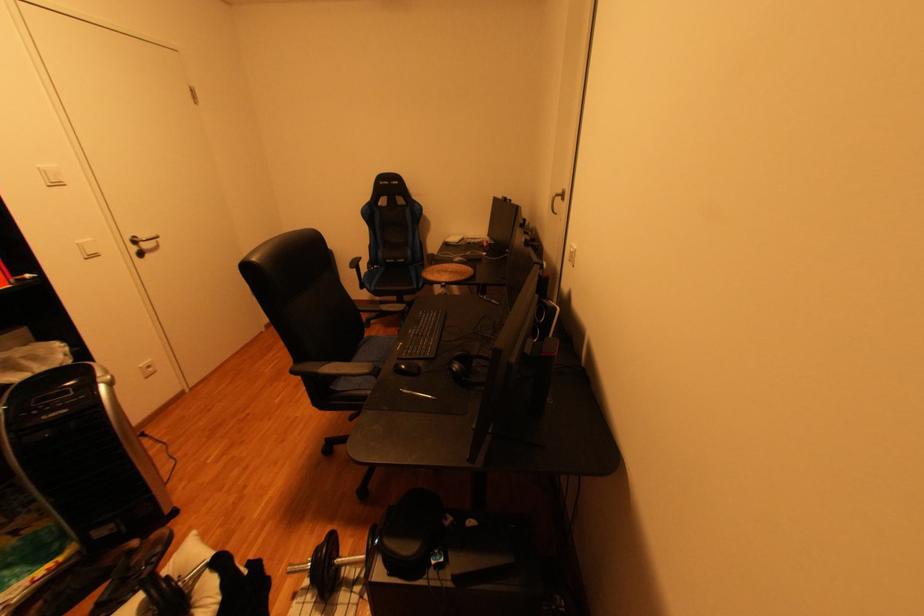
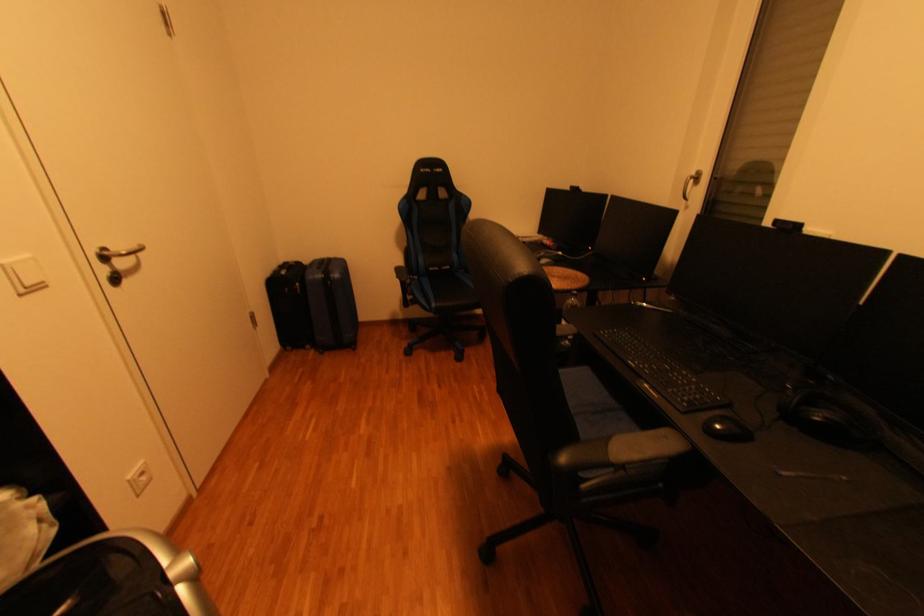
In the scene shown: The images are taken continuously from a first-person perspective. In which direction are you moving?

The movement direction of the cameraman is left, forward.